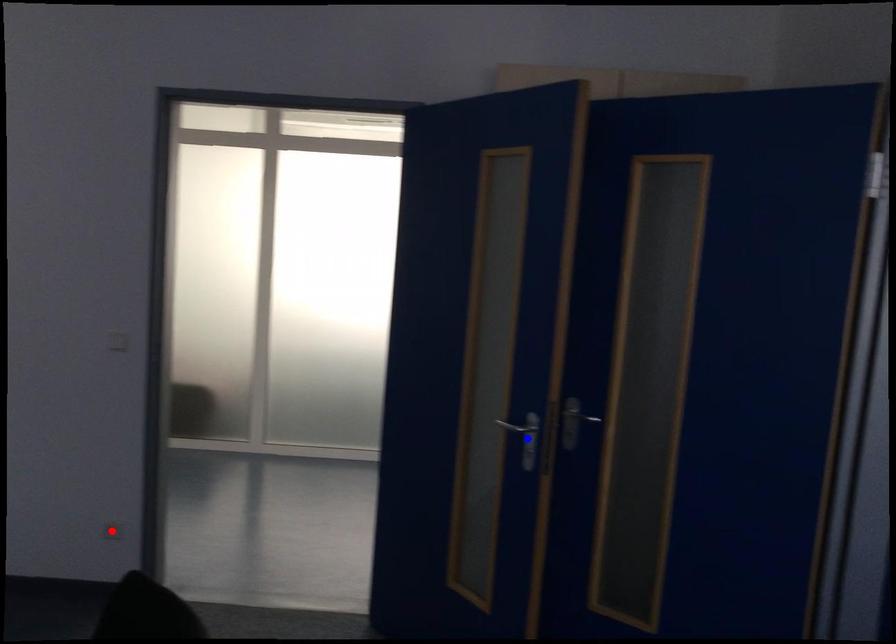
Question: Which of the two points in the image is closer to the camera?

Choices:
 (A) Blue point is closer.
 (B) Red point is closer.

Answer: (A)